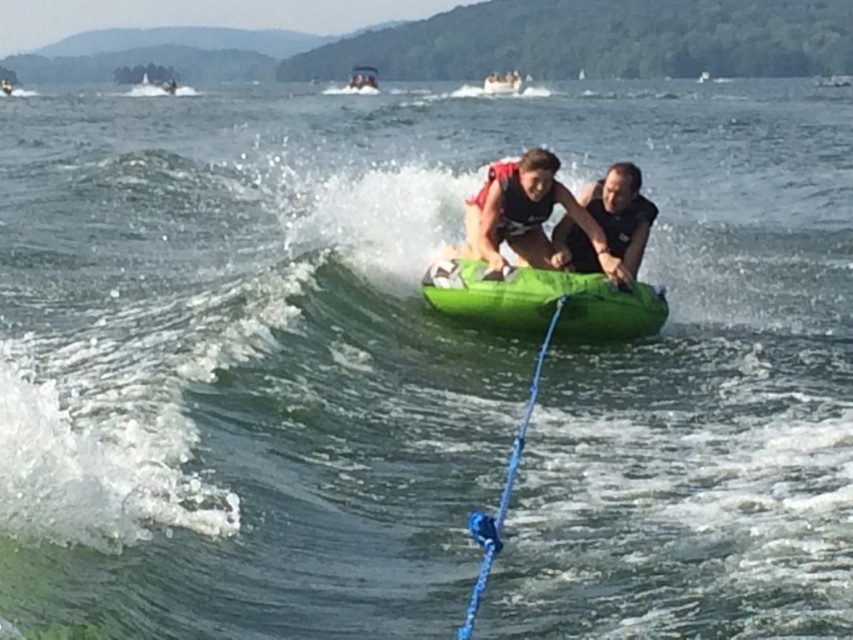
Can you confirm if matte green tube at center is thinner than green rubber tube at center?

Yes.

Which is in front, point (538, 262) or point (352, 72)?

Point (538, 262)

Locate an element on the screen. Image resolution: width=853 pixels, height=640 pixels. matte green tube at center is located at coordinates (527, 218).

Who is higher up, green rubber kayak at center or black matte life vest at center?

black matte life vest at center is higher up.

Who is lower down, green rubber kayak at center or black matte life vest at center?

Positioned lower is green rubber kayak at center.

Find the location of a particular element. green rubber kayak at center is located at coordinates (543, 300).

Does white plastic boat at upper center have a larger size compared to green rubber tube at center?

Correct, white plastic boat at upper center is larger in size than green rubber tube at center.

Does white plastic boat at upper center appear under green rubber tube at center?

Correct, white plastic boat at upper center is located below green rubber tube at center.

The height and width of the screenshot is (640, 853). What do you see at coordinates (502, 83) in the screenshot? I see `white plastic boat at upper center` at bounding box center [502, 83].

At what (x,y) coordinates should I click in order to perform the action: click on white plastic boat at upper center. Please return your answer as a coordinate pair (x, y). The width and height of the screenshot is (853, 640). Looking at the image, I should click on pyautogui.click(x=502, y=83).